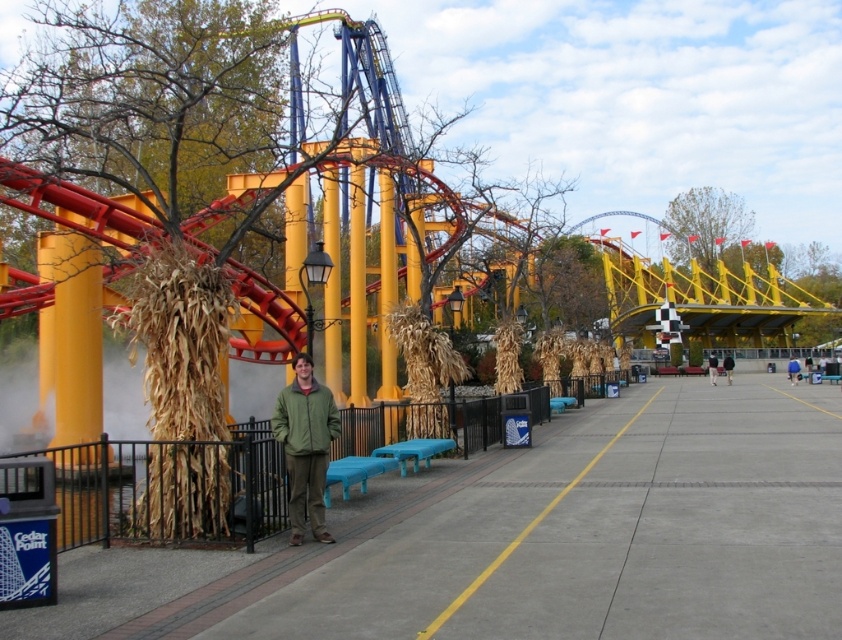
Question: Is the position of green fleece jacket at center more distant than that of dark brown leather jacket at center?

Choices:
 (A) no
 (B) yes

Answer: (A)

Question: Which point is closer to the camera?

Choices:
 (A) blue fabric jacket at center
 (B) dark brown leather jacket at center

Answer: (A)

Question: Does dark blue jeans at center appear on the right side of dark brown leather jacket at center?

Choices:
 (A) no
 (B) yes

Answer: (A)

Question: Among these points, which one is farthest from the camera?

Choices:
 (A) (793, 380)
 (B) (713, 378)
 (C) (286, 442)

Answer: (B)

Question: Does dark blue jeans at center have a smaller size compared to dark brown leather jacket at center?

Choices:
 (A) yes
 (B) no

Answer: (B)

Question: Which point is closer to the camera?

Choices:
 (A) blue fabric jacket at center
 (B) dark blue jeans at center
 (C) green fleece jacket at center

Answer: (C)